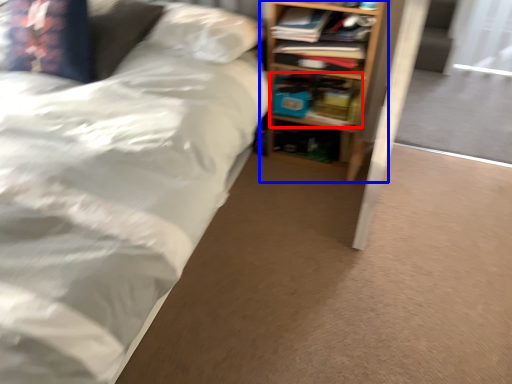
Question: Among these objects, which one is nearest to the camera, book (highlighted by a red box) or shelf (highlighted by a blue box)?

Choices:
 (A) book
 (B) shelf

Answer: (B)